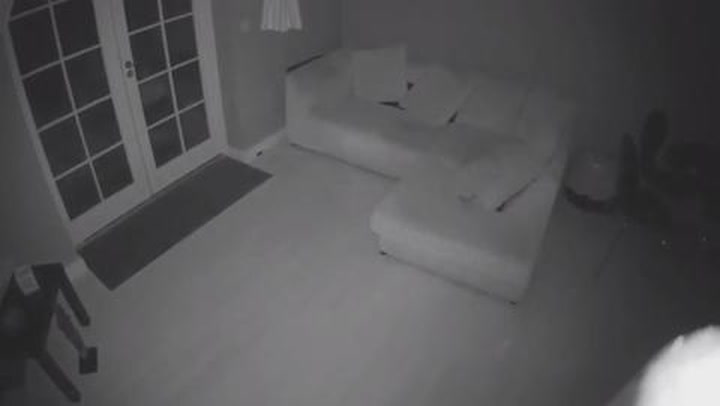
The height and width of the screenshot is (406, 720). I want to click on entry way rug, so click(155, 238).